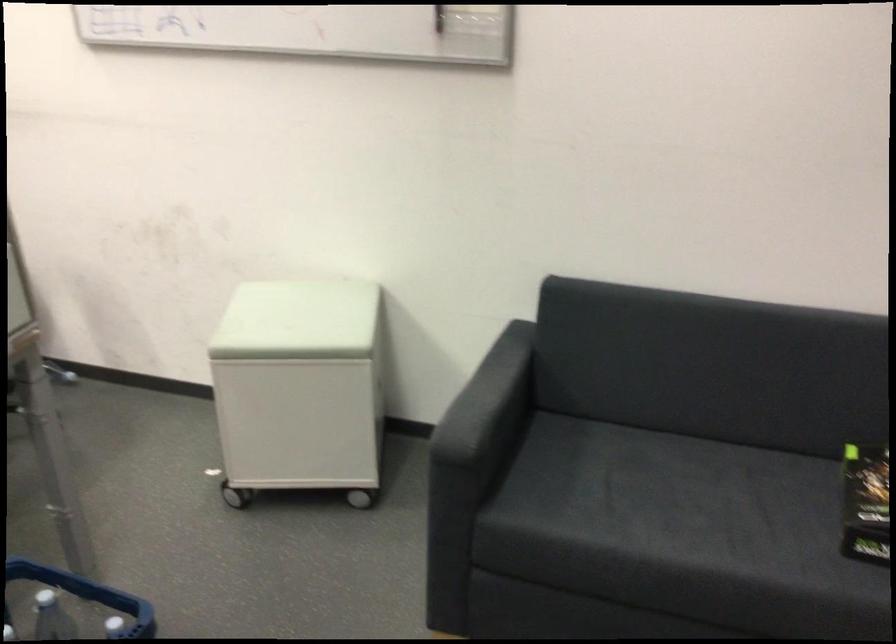
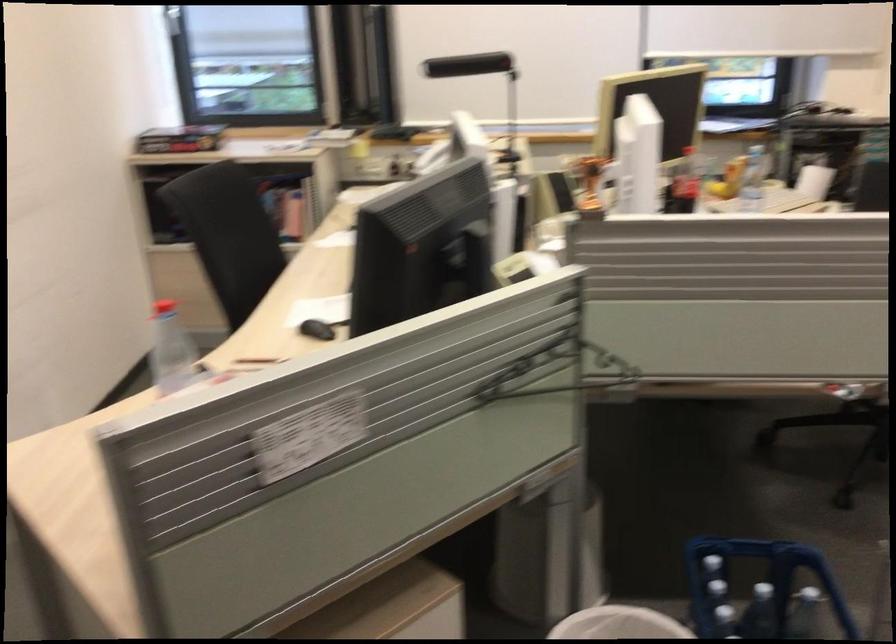
Question: How did the camera likely rotate?

Choices:
 (A) Left
 (B) Right
 (C) Up
 (D) Down

Answer: (A)